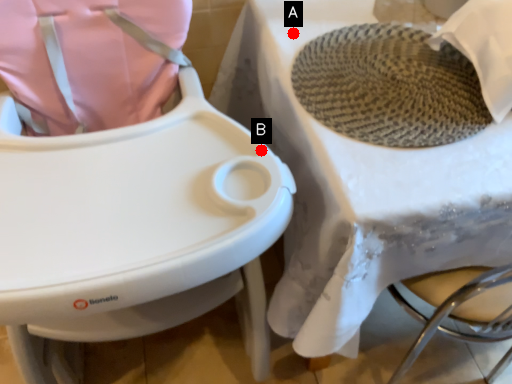
Question: Two points are circled on the image, labeled by A and B beside each circle. Which point appears farthest from the camera in this image?

Choices:
 (A) A is further
 (B) B is further

Answer: (A)